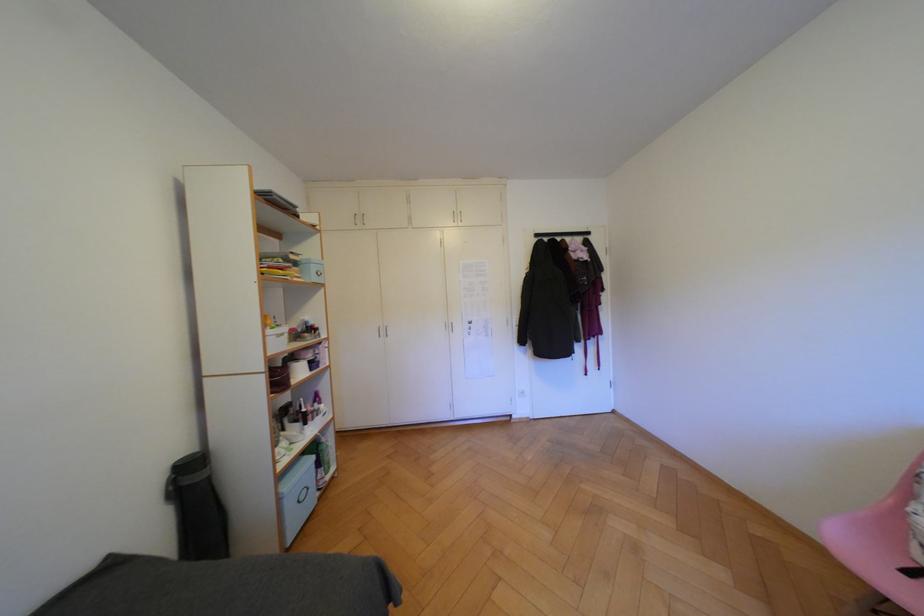
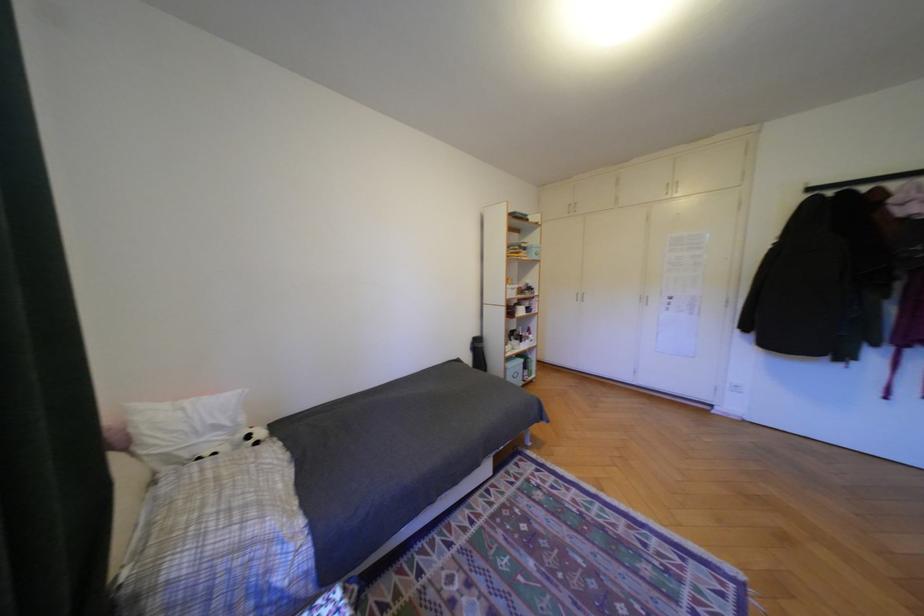
Question: Based on the continuous images, in which direction is the camera rotating? Reply with the corresponding letter.

Choices:
 (A) Left
 (B) Right
 (C) Up
 (D) Down

Answer: (A)